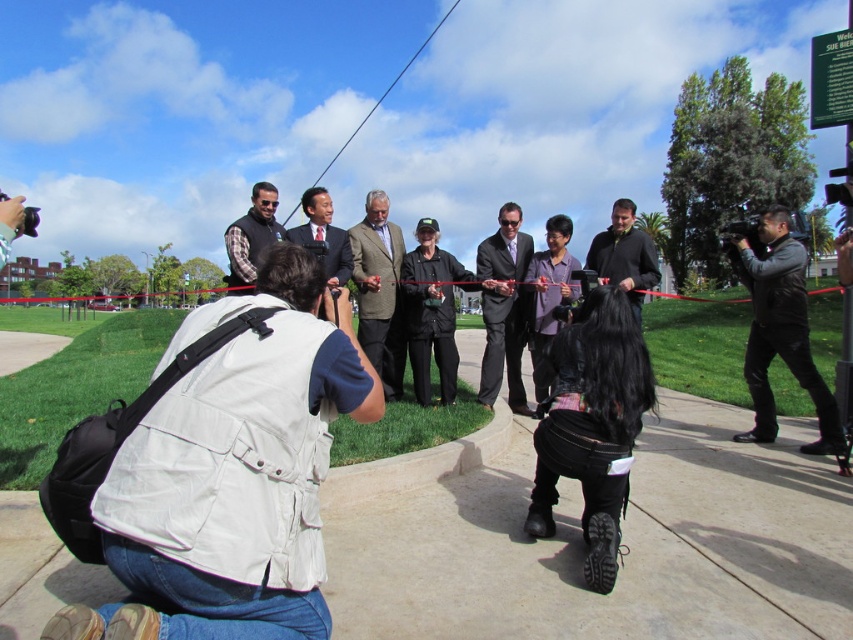
Between point (531, 244) and point (641, 301), which one is positioned in front?

Point (641, 301) is more forward.

Is dark gray suit at center positioned in front of dark brown leather jacket at center?

No, it is behind dark brown leather jacket at center.

Is point (495, 269) positioned after point (622, 220)?

Yes.

Where is `dark gray suit at center`? The width and height of the screenshot is (853, 640). dark gray suit at center is located at coordinates (503, 307).

Is dark gray suit at center smaller than metallic wire at upper center?

Indeed, dark gray suit at center has a smaller size compared to metallic wire at upper center.

Is dark gray suit at center thinner than metallic wire at upper center?

Yes.

At what (x,y) coordinates should I click in order to perform the action: click on dark gray suit at center. Please return your answer as a coordinate pair (x, y). The height and width of the screenshot is (640, 853). Looking at the image, I should click on (503, 307).

Does point (532, 284) come farther from viewer compared to point (637, 310)?

Yes, it is behind point (637, 310).

Between point (550, 288) and point (624, 212), which one is positioned behind?

Positioned behind is point (624, 212).

You are a GUI agent. You are given a task and a screenshot of the screen. Output one action in this format:
    pyautogui.click(x=<x>, y=<y>)
    Task: Click on the purple matte shirt at center
    The height and width of the screenshot is (640, 853).
    Given the screenshot: What is the action you would take?
    pyautogui.click(x=550, y=291)